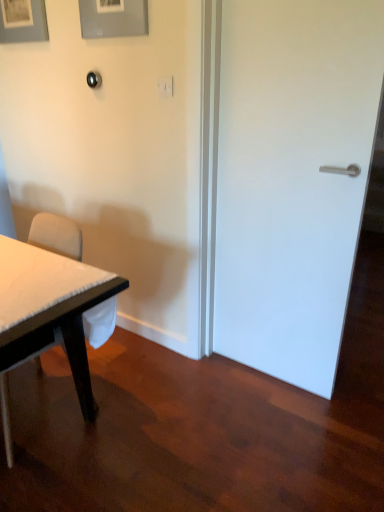
Question: Considering the relative sizes of white fabric chair at left and matte gray picture frame at upper left, which is the first picture frame from left to right, in the image provided, is white fabric chair at left taller than matte gray picture frame at upper left, which is the first picture frame from left to right,?

Choices:
 (A) no
 (B) yes

Answer: (B)

Question: From the image's perspective, is white fabric chair at left located beneath matte gray picture frame at upper left, which appears as the 1th picture frame when viewed from the back?

Choices:
 (A) yes
 (B) no

Answer: (A)

Question: Can you confirm if white fabric chair at left is smaller than matte gray picture frame at upper left, which is the 2th picture frame in right-to-left order?

Choices:
 (A) no
 (B) yes

Answer: (A)

Question: Is white fabric chair at left not near matte gray picture frame at upper left, which appears as the 1th picture frame when viewed from the back?

Choices:
 (A) yes
 (B) no

Answer: (A)

Question: Does white fabric chair at left come in front of matte gray picture frame at upper left, which appears as the 1th picture frame when viewed from the back?

Choices:
 (A) yes
 (B) no

Answer: (A)

Question: Does white fabric chair at left turn towards matte gray picture frame at upper left, which is the first picture frame from left to right?

Choices:
 (A) no
 (B) yes

Answer: (A)

Question: From a real-world perspective, is white fabric chair at left located higher than white matte door at right?

Choices:
 (A) yes
 (B) no

Answer: (B)

Question: From the image's perspective, does white fabric chair at left appear higher than white matte door at right?

Choices:
 (A) yes
 (B) no

Answer: (B)

Question: Does white fabric chair at left have a smaller size compared to white matte door at right?

Choices:
 (A) yes
 (B) no

Answer: (B)

Question: Is white fabric chair at left not close to white matte door at right?

Choices:
 (A) no
 (B) yes

Answer: (A)

Question: Is the position of white fabric chair at left more distant than that of white matte door at right?

Choices:
 (A) no
 (B) yes

Answer: (A)

Question: Considering the relative sizes of white fabric chair at left and white matte door at right in the image provided, is white fabric chair at left wider than white matte door at right?

Choices:
 (A) no
 (B) yes

Answer: (B)

Question: From the image's perspective, is white matte door at right above white fabric chair at left?

Choices:
 (A) no
 (B) yes

Answer: (B)